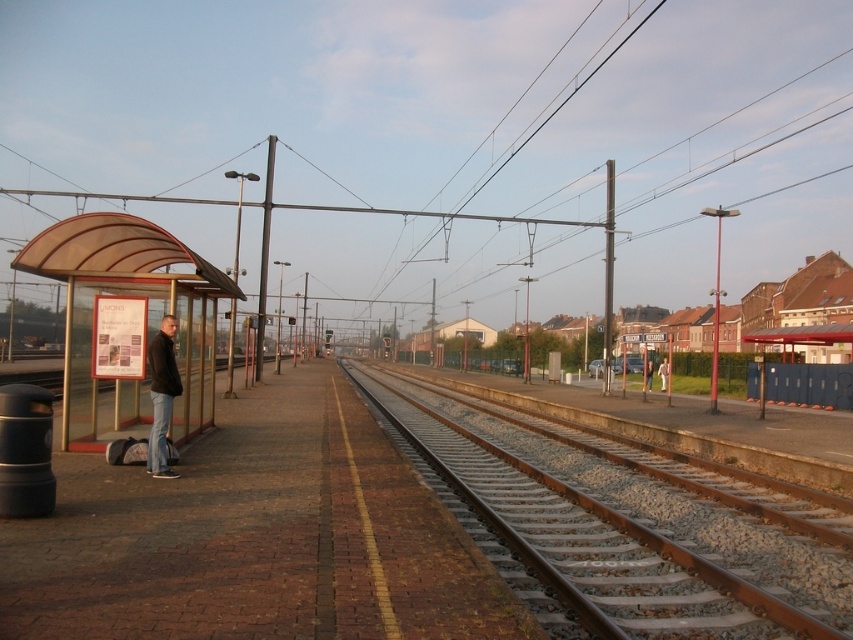
You are a commuter waiting at the train station and need to board the train that arrives from the direction of the rusty metal track at center. However, there is a transparent plastic bus stop at left blocking your path. Can you walk around it to reach the track?

The rusty metal track at center is below the transparent plastic bus stop at left, so you can walk around the transparent plastic bus stop at left to access the track since it is elevated or positioned above the track level.

You are a traveler carrying a large backpack and need to find shelter from the rain. The transparent plastic bus stop at left and the light brown leather jacket at center are both in your view. Which one can provide better protection from the rain?

The transparent plastic bus stop at left has a larger size compared to the light brown leather jacket at center, so it can provide better protection from the rain.